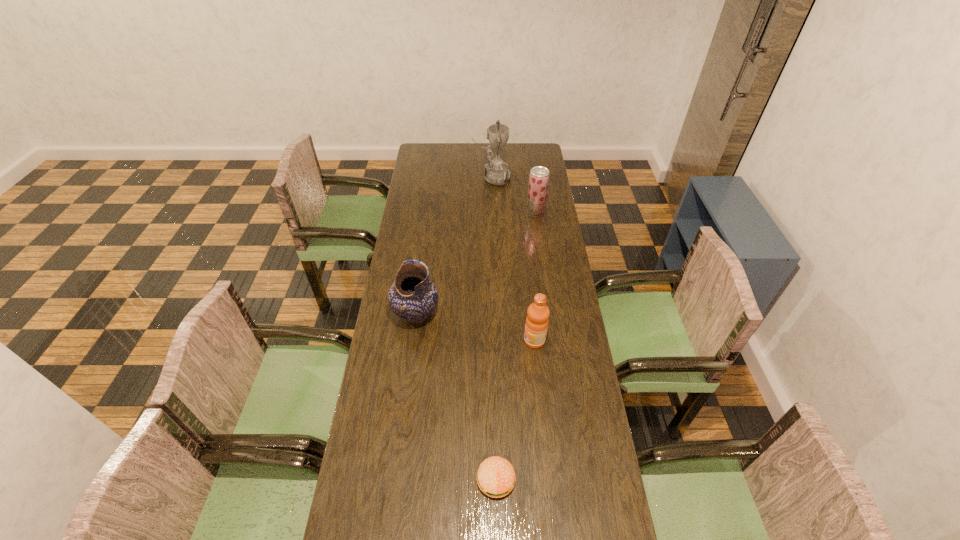
This screenshot has width=960, height=540. I want to click on vacant space at the far left corner of the desktop, so click(417, 145).

Image resolution: width=960 pixels, height=540 pixels. I want to click on vacant space at the far right corner, so click(531, 163).

Locate an element on the screen. The height and width of the screenshot is (540, 960). vacant area between the leftmost object and the tallest object is located at coordinates (454, 246).

Image resolution: width=960 pixels, height=540 pixels. In order to click on free spot between the nearer fruit juice and the nearest object in this screenshot , I will do `click(516, 410)`.

This screenshot has width=960, height=540. Find the location of `free space between the leftmost object and the tallest object`. free space between the leftmost object and the tallest object is located at coordinates (454, 246).

You are a GUI agent. You are given a task and a screenshot of the screen. Output one action in this format:
    pyautogui.click(x=<x>, y=<y>)
    Task: Click on the vacant space in between the patty and the farther fruit juice
    
    Given the screenshot: What is the action you would take?
    pyautogui.click(x=516, y=346)

Where is `vacant space that's between the farther fruit juice and the nearer fruit juice`? This screenshot has width=960, height=540. vacant space that's between the farther fruit juice and the nearer fruit juice is located at coordinates click(x=535, y=276).

You are a GUI agent. You are given a task and a screenshot of the screen. Output one action in this format:
    pyautogui.click(x=<x>, y=<y>)
    Task: Click on the vacant region between the nearer fruit juice and the farther fruit juice
    
    Given the screenshot: What is the action you would take?
    pyautogui.click(x=535, y=276)

Identify the location of free spot between the patty and the farther fruit juice. The height and width of the screenshot is (540, 960). (516, 346).

Locate an element on the screen. The height and width of the screenshot is (540, 960). object that is the closest to the farther fruit juice is located at coordinates (496, 172).